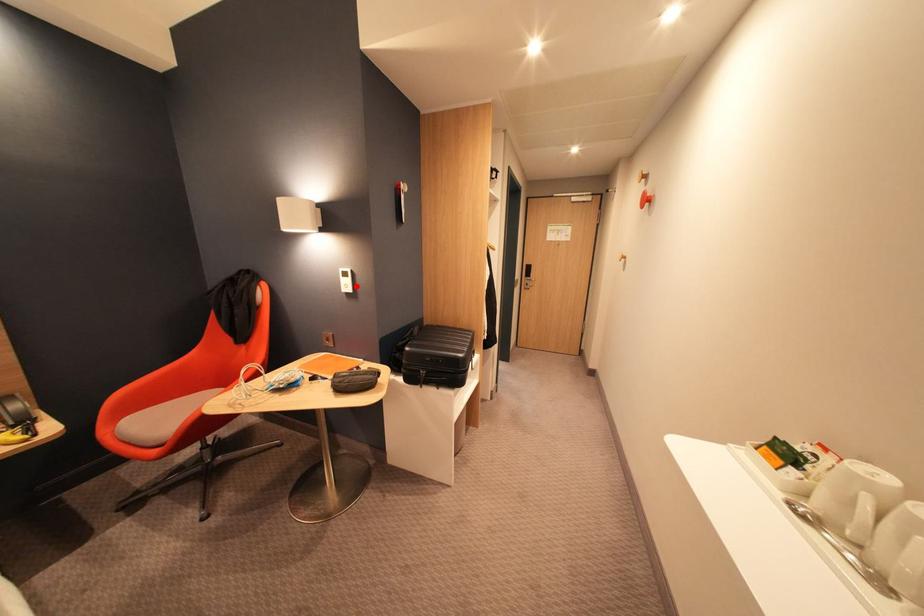
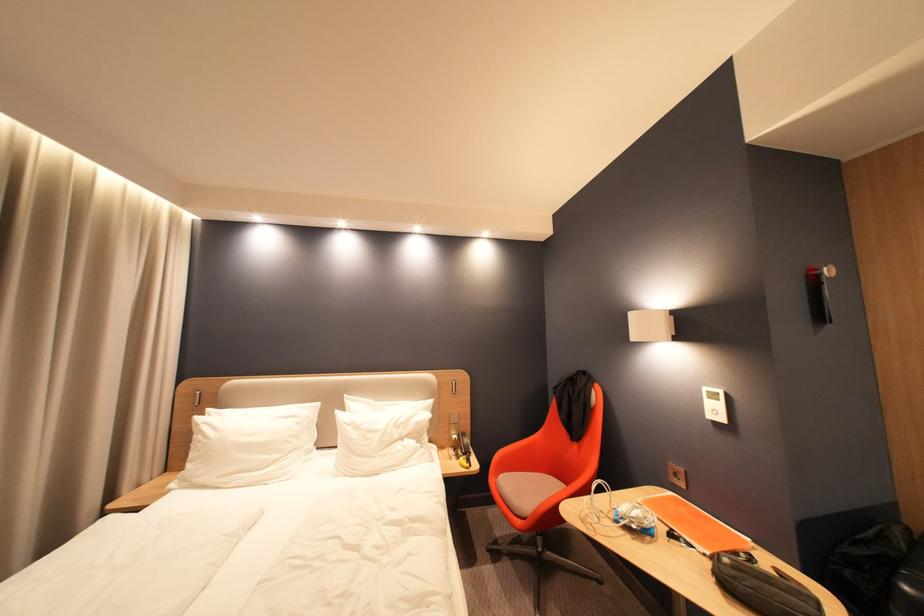
Where in the second image is the point corresponding to the highlighted location from the first image?

(724, 413)